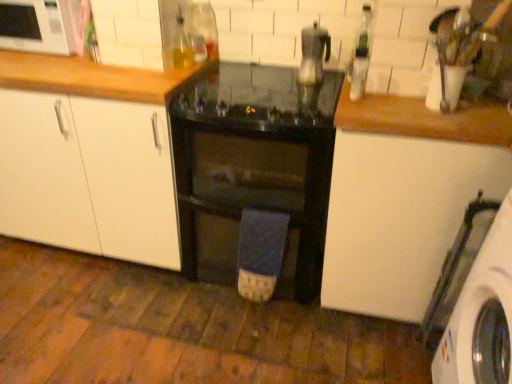
Where is `vacant space in front of blue cotton bath towel at center`? The width and height of the screenshot is (512, 384). vacant space in front of blue cotton bath towel at center is located at coordinates [x=251, y=329].